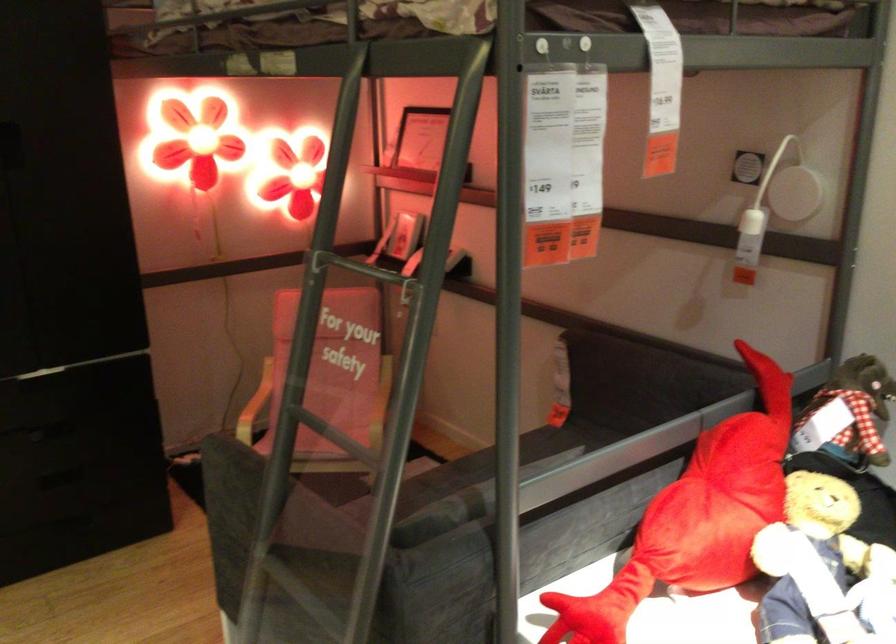
This screenshot has height=644, width=896. Identify the location of teddy bear toy. (823, 569).